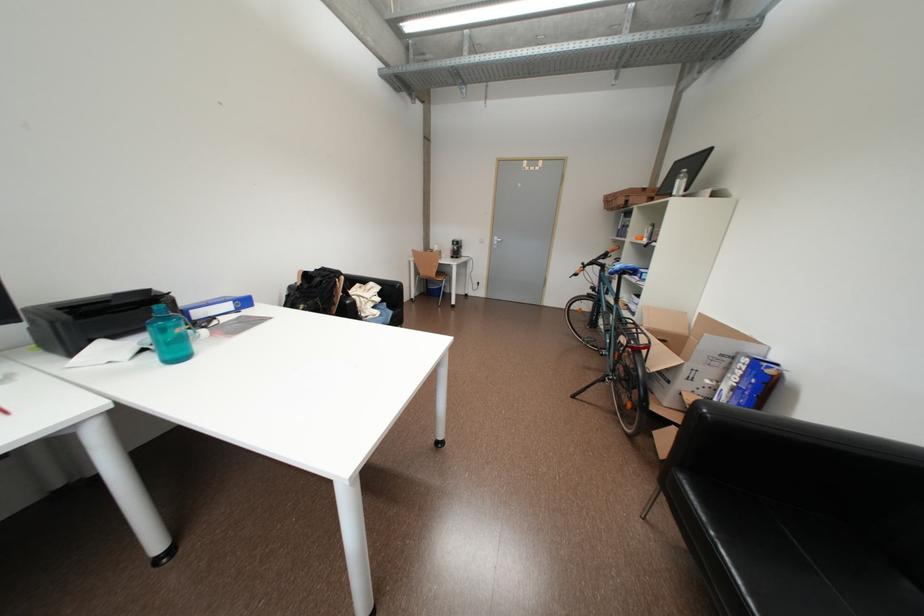
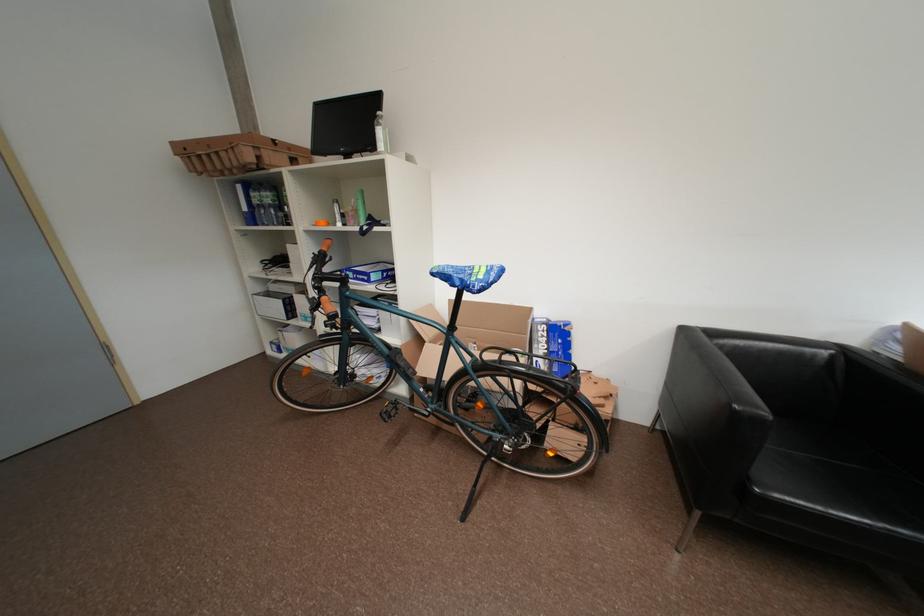
The point at (755, 362) is marked in the first image. Where is the corresponding point in the second image?

(553, 329)